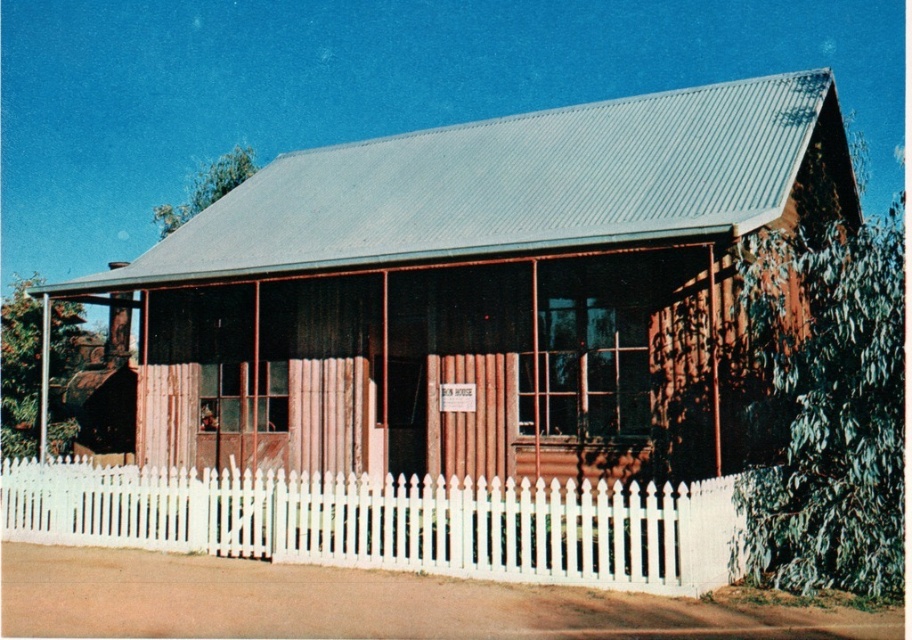
Which of these two, brown wooden hut at center or white picket fence at center, stands taller?

→ brown wooden hut at center

The height and width of the screenshot is (640, 912). I want to click on brown wooden hut at center, so click(482, 291).